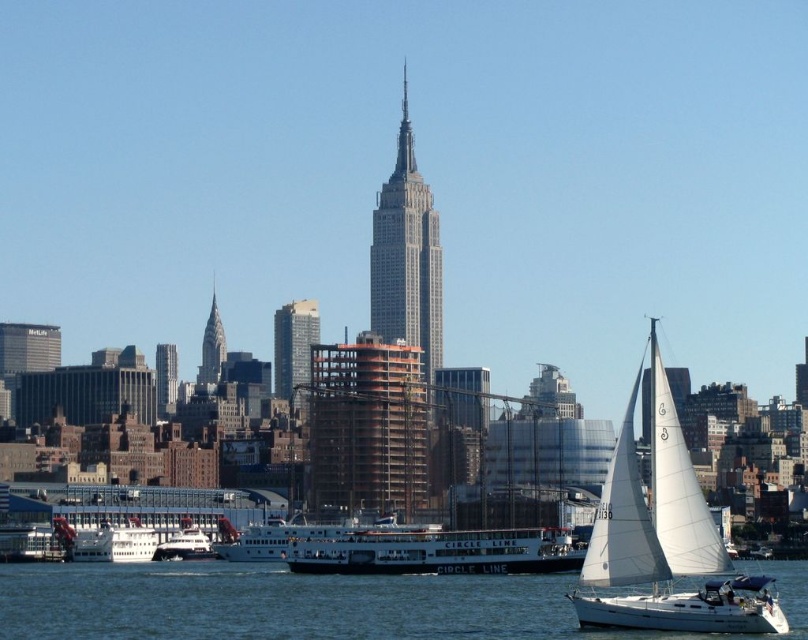
Question: Which of the following is the closest to the observer?

Choices:
 (A) (470, 531)
 (B) (264, 538)
 (C) (625, 554)
 (D) (806, 589)

Answer: (A)

Question: From the image, what is the correct spatial relationship of white sailboat at right in relation to white matte ferry at center?

Choices:
 (A) right
 (B) left

Answer: (A)

Question: Among these points, which one is farthest from the camera?

Choices:
 (A) (659, 364)
 (B) (407, 556)
 (C) (312, 532)

Answer: (A)

Question: Can you confirm if white matte boat at center is positioned above white matte ferry at center?

Choices:
 (A) yes
 (B) no

Answer: (B)

Question: Is white sailboat at right further to camera compared to white matte ferry at center?

Choices:
 (A) yes
 (B) no

Answer: (A)

Question: Which point is farther to the camera?

Choices:
 (A) white matte ferry at center
 (B) white sailboat at right
 (C) clear blue water at lower center
 (D) white matte boat at center

Answer: (B)